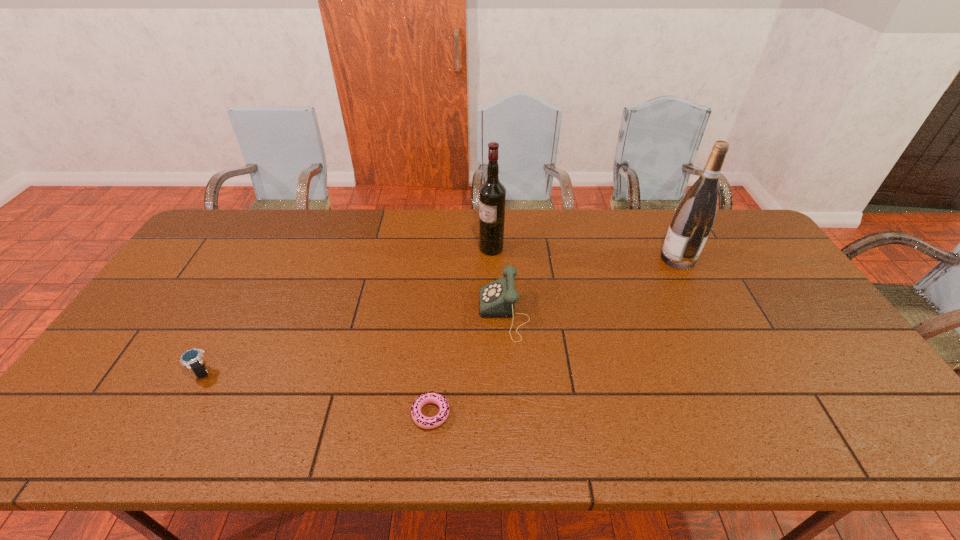
Identify the location of vacant area that lies between the leftmost object and the right wine bottle. (440, 315).

Find the location of a particular element. Image resolution: width=960 pixels, height=540 pixels. free space between the rightmost object and the third tallest object is located at coordinates (591, 286).

This screenshot has height=540, width=960. I want to click on object that ranks as the fourth closest to the rightmost object, so click(x=192, y=358).

Locate an element on the screen. This screenshot has width=960, height=540. object that is the closest to the watch is located at coordinates (432, 397).

Locate an element on the screen. vacant space that satisfies the following two spatial constraints: 1. on the label of the right wine bottle; 2. on the front side of the nearest object is located at coordinates (756, 414).

The width and height of the screenshot is (960, 540). Find the location of `vacant region that satisfies the following two spatial constraints: 1. on the front and back of the left wine bottle; 2. on the front side of the leftmost object`. vacant region that satisfies the following two spatial constraints: 1. on the front and back of the left wine bottle; 2. on the front side of the leftmost object is located at coordinates (495, 372).

At what (x,y) coordinates should I click in order to perform the action: click on vacant space that satisfies the following two spatial constraints: 1. on the dial of the third shortest object; 2. on the front side of the leftmost object. Please return your answer as a coordinate pair (x, y). This screenshot has width=960, height=540. Looking at the image, I should click on (508, 372).